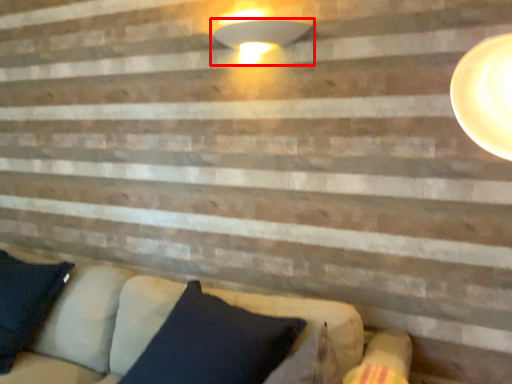
Question: In this image, where is lamp (annotated by the red box) located relative to studio couch?

Choices:
 (A) right
 (B) left

Answer: (B)